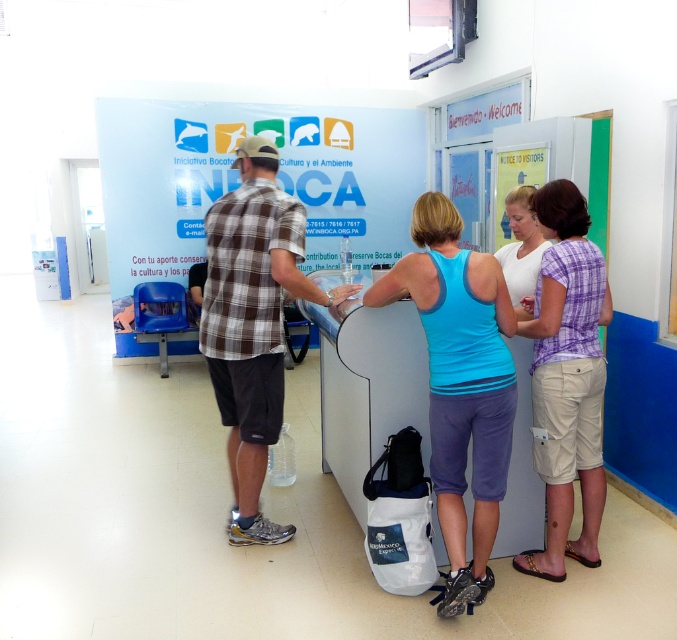
Question: Which of the following is the farthest from the observer?

Choices:
 (A) beige cotton shorts at center
 (B) blue fabric tank top at center

Answer: (A)

Question: Among these objects, which one is farthest from the camera?

Choices:
 (A) blue fabric tank top at center
 (B) beige cotton shorts at center
 (C) brown plaid shirt at center

Answer: (C)

Question: Estimate the real-world distances between objects in this image. Which object is closer to the beige cotton shorts at center?

Choices:
 (A) brown plaid shirt at center
 (B) blue fabric tank top at center

Answer: (B)

Question: Is blue fabric tank top at center positioned before beige cotton shorts at center?

Choices:
 (A) no
 (B) yes

Answer: (B)

Question: Is blue fabric tank top at center smaller than beige cotton shorts at center?

Choices:
 (A) no
 (B) yes

Answer: (A)

Question: Can you confirm if brown plaid shirt at center is wider than beige cotton shorts at center?

Choices:
 (A) yes
 (B) no

Answer: (A)